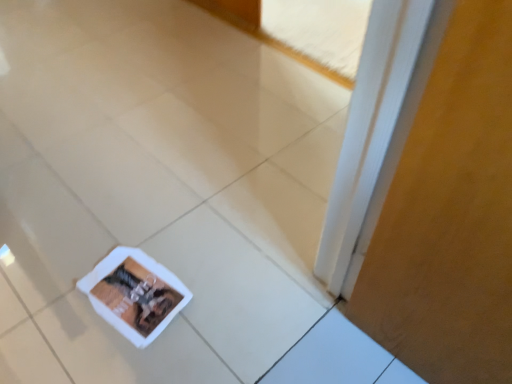
Locate an element on the screen. This screenshot has height=384, width=512. vacant point to the right of white glossy magazine at lower left is located at coordinates (233, 300).